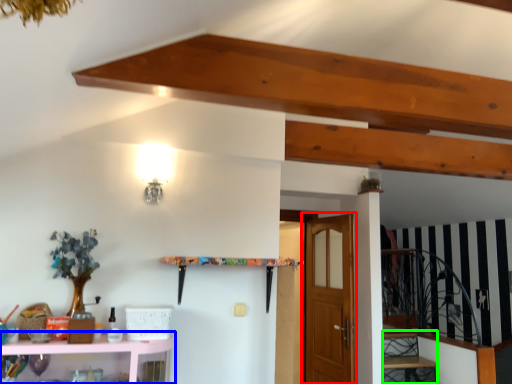
Question: Considering the real-world distances, which object is closest to door (highlighted by a red box)? shelf (highlighted by a blue box) or stairwell (highlighted by a green box).

Choices:
 (A) shelf
 (B) stairwell

Answer: (B)